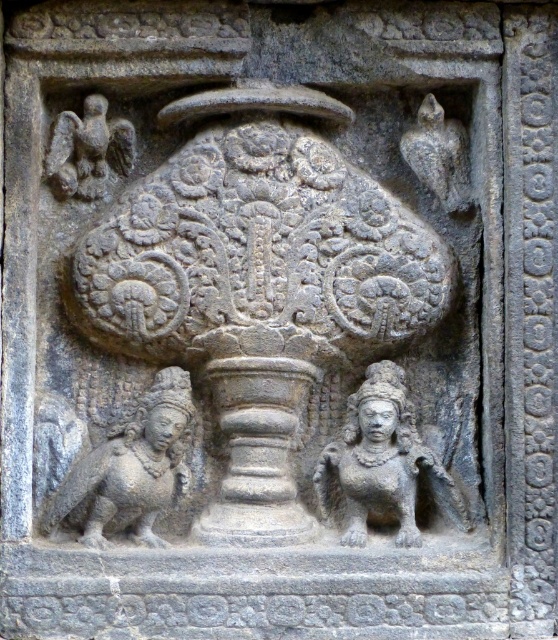
You are an archaeologist examining the stone carving. You need to locate the gray stone vase at center. What are its coordinates?

The gray stone vase at center is located at point (x=258, y=292).

You are an archaeologist examining the stone carving. You need to locate the gray stone vase at center. What are its coordinates?

The gray stone vase at center is located at coordinates point (x=258, y=292).